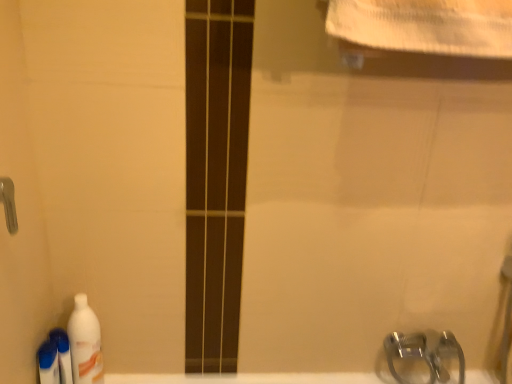
Question: Would you say white glossy bottle at lower left, which ranks as the third cleaning product in left-to-right order, is inside or outside white glossy bottle at lower left, the second cleaning product in the left-to-right sequence?

Choices:
 (A) outside
 (B) inside

Answer: (A)

Question: From their relative heights in the image, would you say white glossy bottle at lower left, which ranks as the third cleaning product in left-to-right order, is taller or shorter than white glossy bottle at lower left, the second cleaning product in the left-to-right sequence?

Choices:
 (A) short
 (B) tall

Answer: (B)

Question: Based on their relative distances, which object is farther from the white glossy bottle at lower left, which is the second cleaning product from right to left?

Choices:
 (A) white glossy bottle at lower left, which ranks as the first cleaning product in right-to-left order
 (B) translucent plastic bottle at lower left, the 3th cleaning product positioned from the right
 (C) white glossy bath at lower center

Answer: (C)

Question: Estimate the real-world distances between objects in this image. Which object is farther from the white glossy bottle at lower left, which ranks as the first cleaning product in right-to-left order?

Choices:
 (A) translucent plastic bottle at lower left, the 3th cleaning product positioned from the right
 (B) white glossy bottle at lower left, which is the second cleaning product from right to left
 (C) white glossy bath at lower center

Answer: (C)